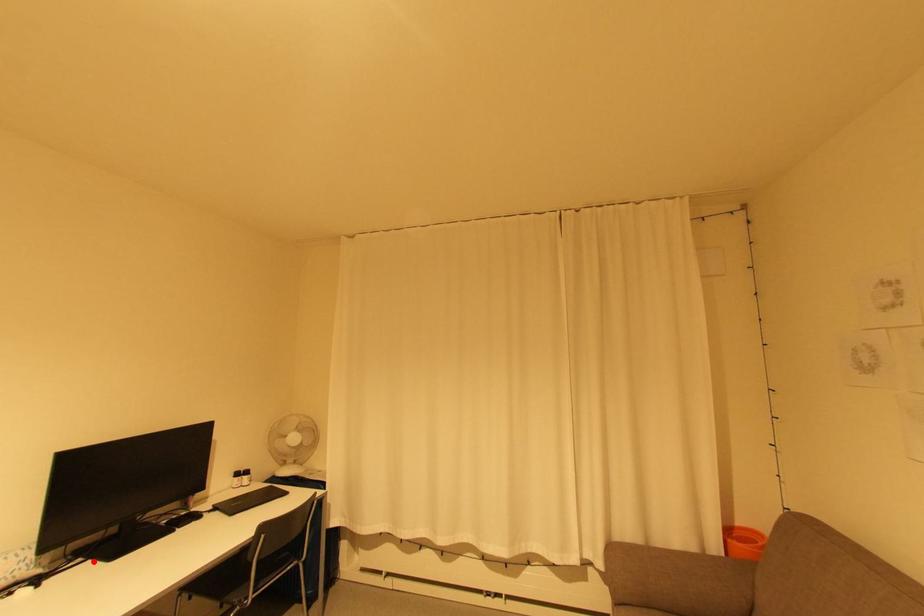
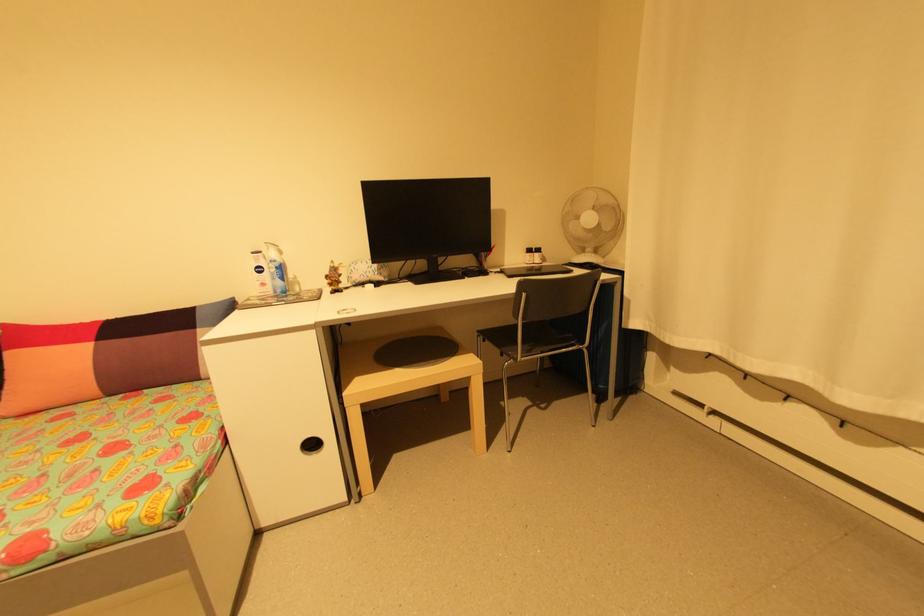
In the second image, find the point that corresponds to the highlighted location in the first image.

(414, 283)